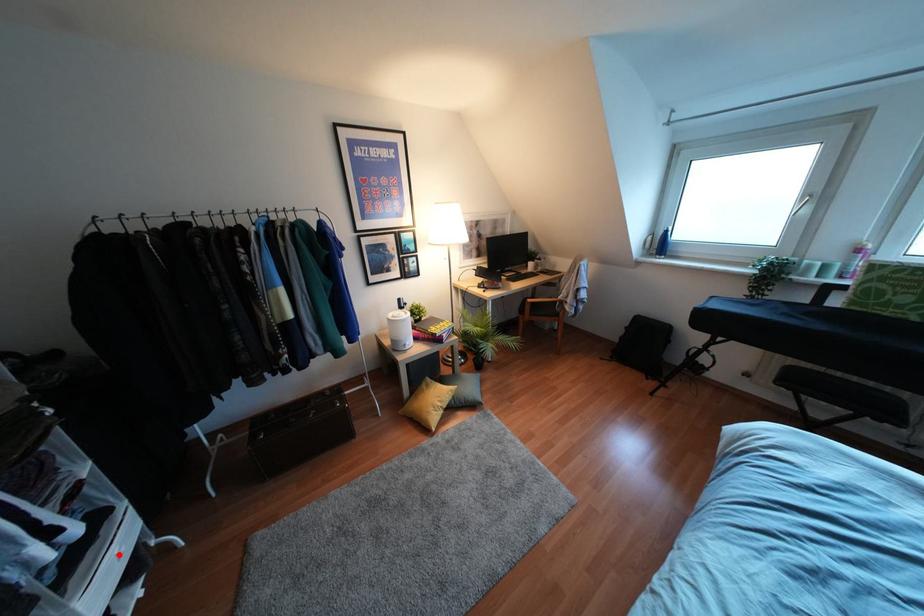
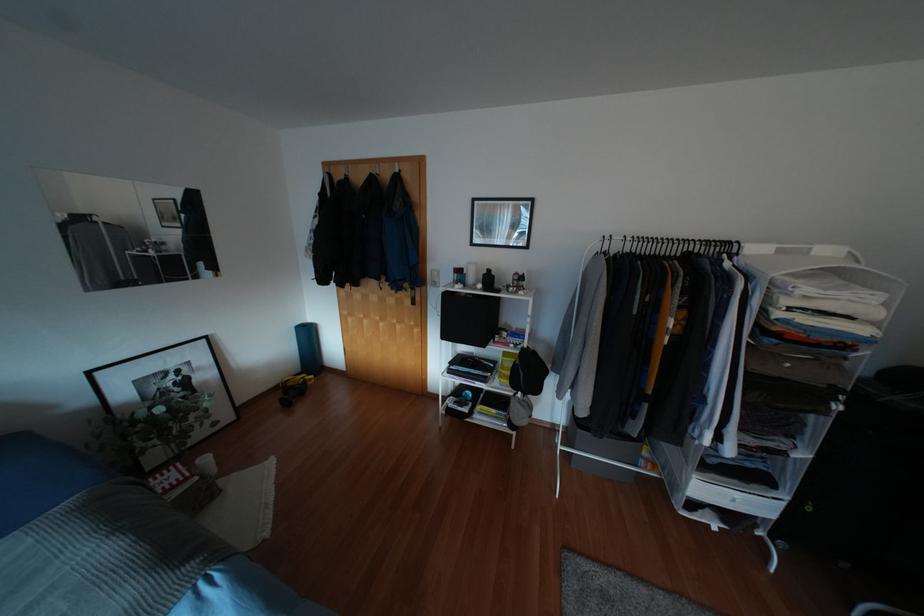
Where in the second image is the point corresponding to the highlighted location from the first image?

(734, 500)